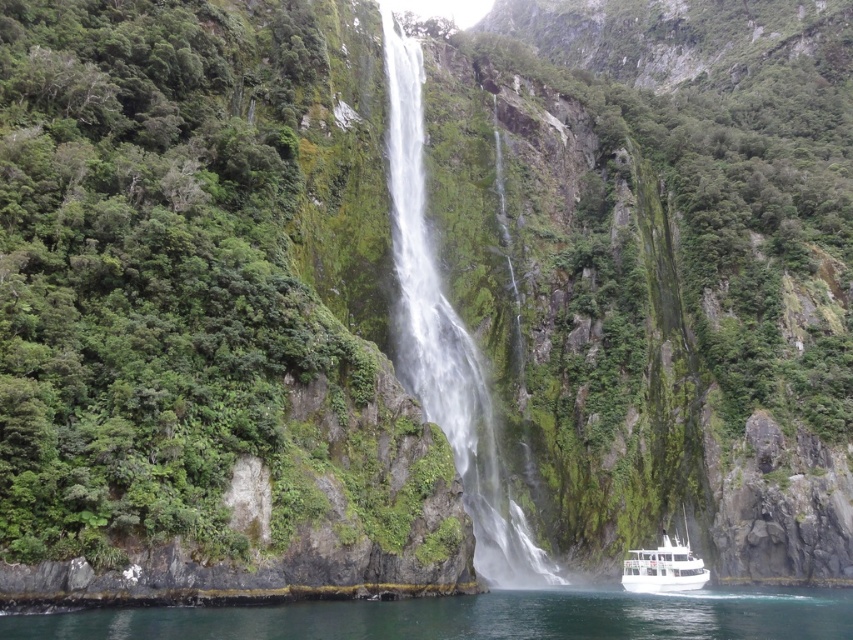
You are a kayaker planning to approach the white frothy water at center from the white glossy boat at lower center. Given that your kayak can only handle currents within 50 feet of the boat, will you be able to safely reach the water?

The distance between the white frothy water at center and the white glossy boat at lower center is 78.43 feet. Since your kayak can only handle currents within 50 feet of the boat, you will not be able to safely reach the water as the distance exceeds the safe range.

In the scene shown: You are standing at the base of the cliff and want to board the white glossy boat at lower center. Which direction should you walk to reach it, considering the white frothy water at center is blocking your path?

The white frothy water at center is closer to you than the white glossy boat at lower center, so you should walk around the waterfall to the right side where the boat is located to reach it.

You are a hiker standing at the base of the cliff looking up at the waterfall. You notice two points marked on the cliff face. Which point is closer to you, point (405, 113) or point (645, 566)?

Point (405, 113) is closer to you because it is further to the viewer than point (645, 566).